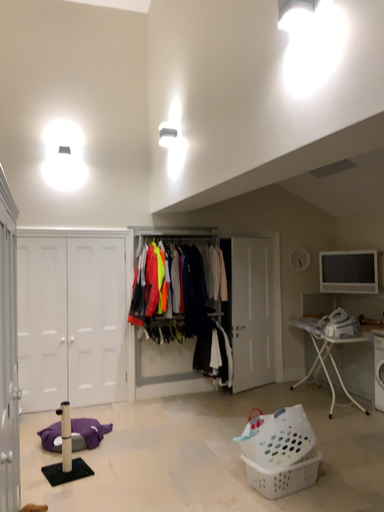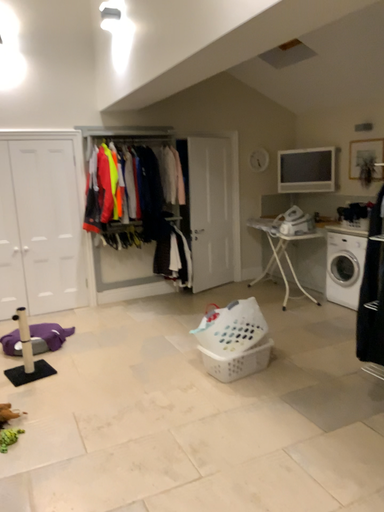
Question: How did the camera likely rotate when shooting the video?

Choices:
 (A) rotated upward
 (B) rotated downward

Answer: (B)